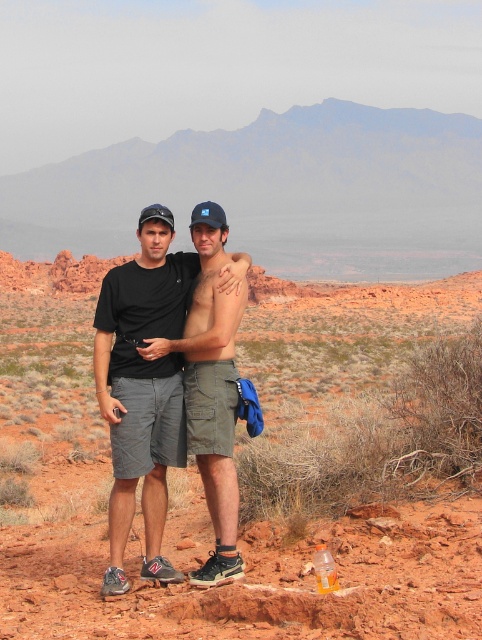
Does matte black t-shirt at center have a lesser width compared to green cargo shorts at center?

No, matte black t-shirt at center is not thinner than green cargo shorts at center.

In order to click on matte black t-shirt at center in this screenshot , I will do pos(143,387).

Describe the element at coordinates (143, 387) in the screenshot. This screenshot has width=482, height=640. I see `matte black t-shirt at center` at that location.

Locate an element on the screen. matte black t-shirt at center is located at coordinates (143, 387).

Who is taller, rustic sandstone rock at center or matte black t-shirt at center?

rustic sandstone rock at center

Is rustic sandstone rock at center below matte black t-shirt at center?

No.

Which is in front, point (282, 294) or point (150, 285)?

Point (150, 285) is in front.

The width and height of the screenshot is (482, 640). I want to click on rustic sandstone rock at center, so click(141, 516).

Can you confirm if rustic sandstone rock at center is taller than green cargo shorts at center?

Indeed, rustic sandstone rock at center has a greater height compared to green cargo shorts at center.

Measure the distance between rustic sandstone rock at center and camera.

9.80 meters

Which is in front, point (198, 604) or point (213, 524)?

Point (198, 604)

Locate an element on the screen. This screenshot has height=640, width=482. rustic sandstone rock at center is located at coordinates (141, 516).